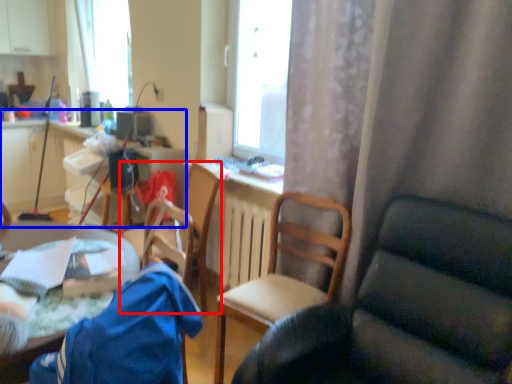
Question: Among these objects, which one is nearest to the camera, chair (highlighted by a red box) or computer desk (highlighted by a blue box)?

Choices:
 (A) chair
 (B) computer desk

Answer: (A)